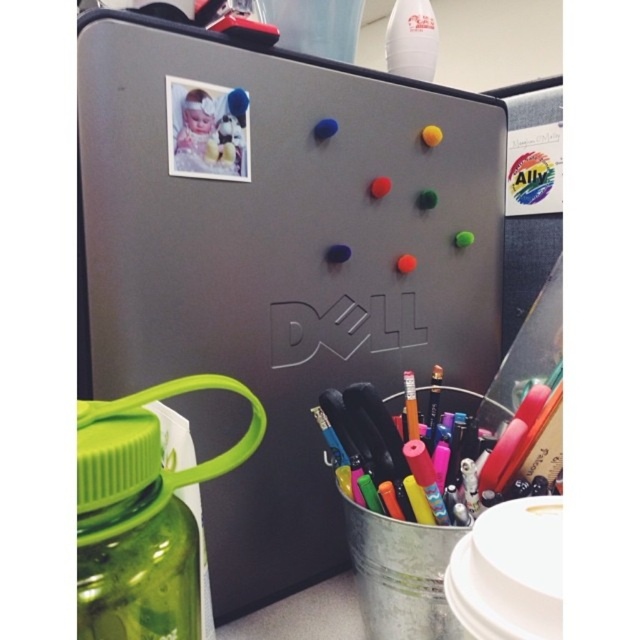
Can you confirm if green plastic water bottle at lower left is thinner than metallic pen at center?

Yes.

Does green plastic water bottle at lower left have a greater width compared to metallic pen at center?

No.

Is point (144, 550) positioned after point (538, 413)?

No.

The height and width of the screenshot is (640, 640). Find the location of `green plastic water bottle at lower left`. green plastic water bottle at lower left is located at coordinates (148, 579).

In the scene shown: Which is above, metallic gray fridge at center or green plastic water bottle at lower left?

metallic gray fridge at center

Can you confirm if metallic gray fridge at center is positioned to the right of green plastic water bottle at lower left?

Yes, metallic gray fridge at center is to the right of green plastic water bottle at lower left.

At what (x,y) coordinates should I click in order to perform the action: click on metallic gray fridge at center. Please return your answer as a coordinate pair (x, y). Looking at the image, I should click on (280, 259).

Locate an element on the screen. This screenshot has width=640, height=640. metallic gray fridge at center is located at coordinates (280, 259).

Can you confirm if metallic gray fridge at center is positioned below metallic pen at center?

Actually, metallic gray fridge at center is above metallic pen at center.

Measure the distance between point (x=172, y=330) and camera.

A distance of 19.67 inches exists between point (x=172, y=330) and camera.

This screenshot has width=640, height=640. Find the location of `metallic gray fridge at center`. metallic gray fridge at center is located at coordinates (280, 259).